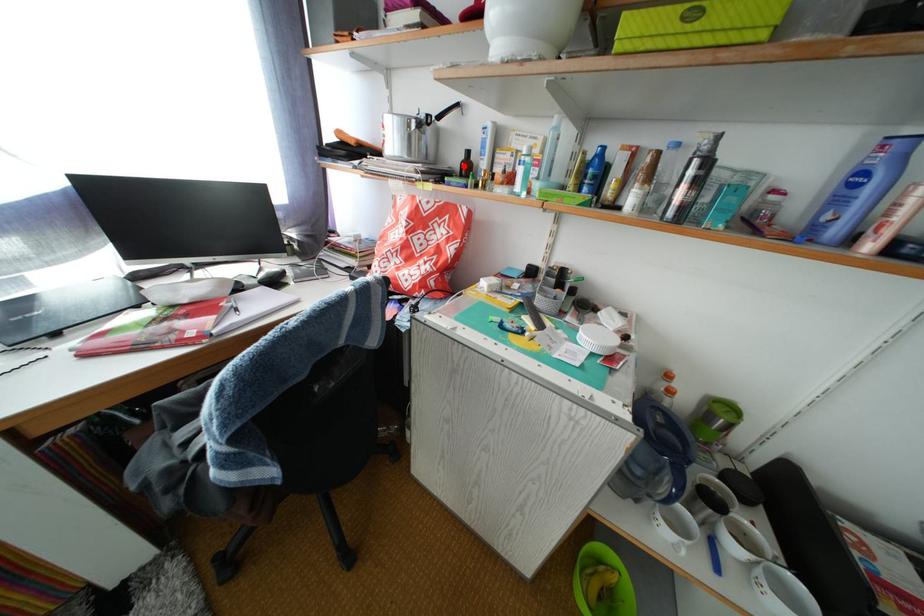
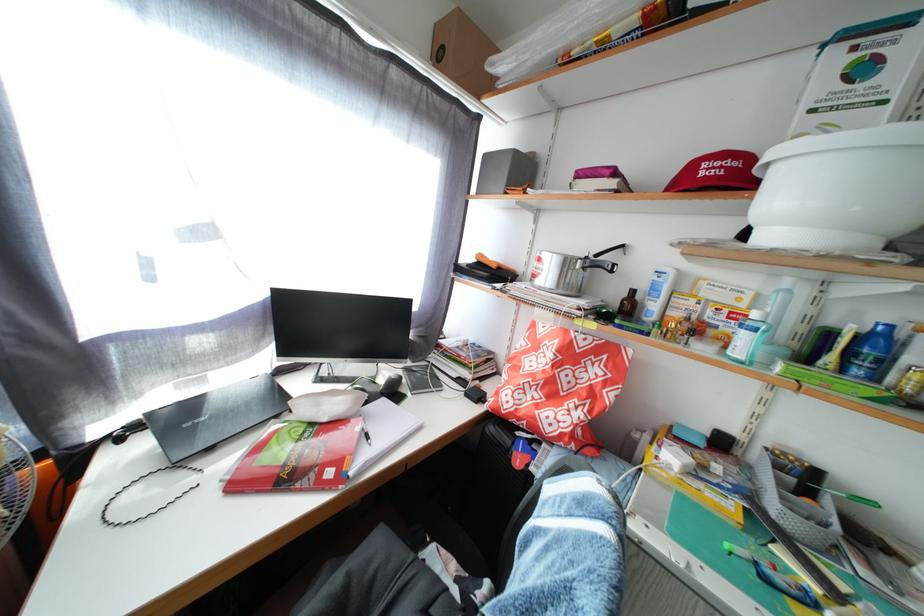
Find the pixel in the second image that matches the highlighted location in the first image.

(621, 301)